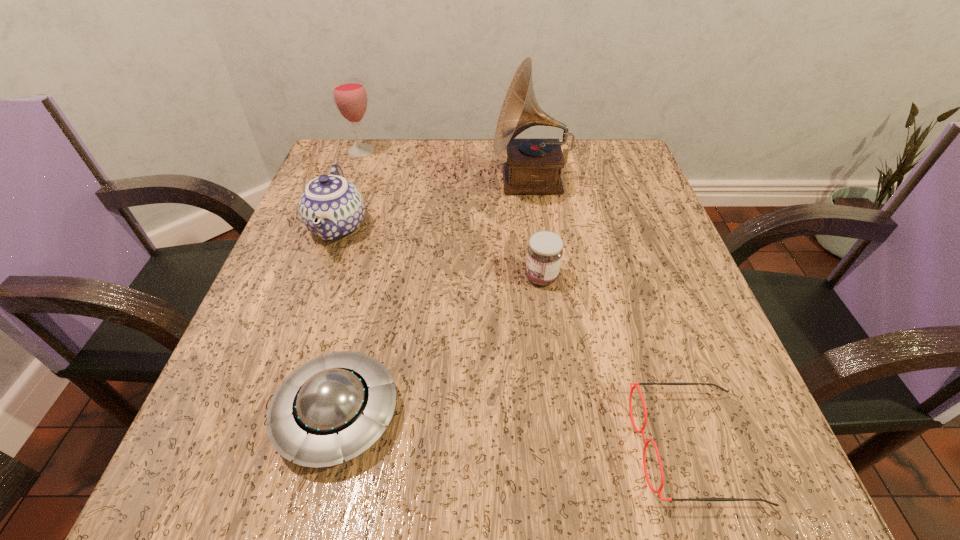
Where is `free space located 0.310m on the right of the second tallest object`? free space located 0.310m on the right of the second tallest object is located at coordinates (503, 151).

What are the coordinates of `vacant space located 0.330m from the spout of the chinaware` in the screenshot? It's located at (265, 434).

Find the location of `vacant space located 0.070m on the front label of the third nearest object`. vacant space located 0.070m on the front label of the third nearest object is located at coordinates (485, 278).

Where is `vacant space located on the front label of the third nearest object`? The height and width of the screenshot is (540, 960). vacant space located on the front label of the third nearest object is located at coordinates (350, 278).

You are a GUI agent. You are given a task and a screenshot of the screen. Output one action in this format:
    pyautogui.click(x=<x>, y=<y>)
    Task: Click on the free region located on the front label of the third nearest object
    
    Given the screenshot: What is the action you would take?
    pyautogui.click(x=418, y=278)

The width and height of the screenshot is (960, 540). I want to click on vacant space situated on the back of the saucer, so click(376, 253).

Find the location of `vacant region located 0.080m on the front-facing side of the shortest object`. vacant region located 0.080m on the front-facing side of the shortest object is located at coordinates (576, 447).

Where is `vacant space located on the front-facing side of the shortest object`? The width and height of the screenshot is (960, 540). vacant space located on the front-facing side of the shortest object is located at coordinates (492, 447).

Locate an element on the screen. This screenshot has width=960, height=540. vacant point located on the front-facing side of the shortest object is located at coordinates (368, 447).

Where is `phonograph record present at the far edge`? phonograph record present at the far edge is located at coordinates (533, 166).